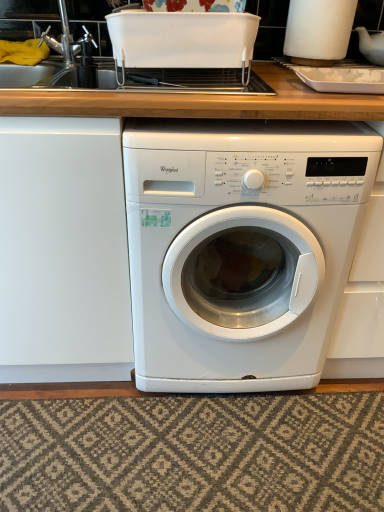
Question: Considering the positions of textured beige rug at lower center and white glossy washing machine at center in the image, is textured beige rug at lower center taller or shorter than white glossy washing machine at center?

Choices:
 (A) short
 (B) tall

Answer: (A)

Question: From a real-world perspective, relative to white glossy washing machine at center, is textured beige rug at lower center vertically above or below?

Choices:
 (A) above
 (B) below

Answer: (B)

Question: Which of these objects is positioned closest to the brushed metal sink at upper left?

Choices:
 (A) white glossy washing machine at center
 (B) textured beige rug at lower center
 (C) white plastic container at upper center, acting as the 1th appliance starting from the left
 (D) white glossy container at upper right, which is the second appliance in left-to-right order

Answer: (C)

Question: Which is farther from the white glossy container at upper right, which is the second appliance in left-to-right order?

Choices:
 (A) textured beige rug at lower center
 (B) brushed metal sink at upper left
 (C) white plastic container at upper center, the second appliance when ordered from right to left
 (D) white glossy washing machine at center

Answer: (A)